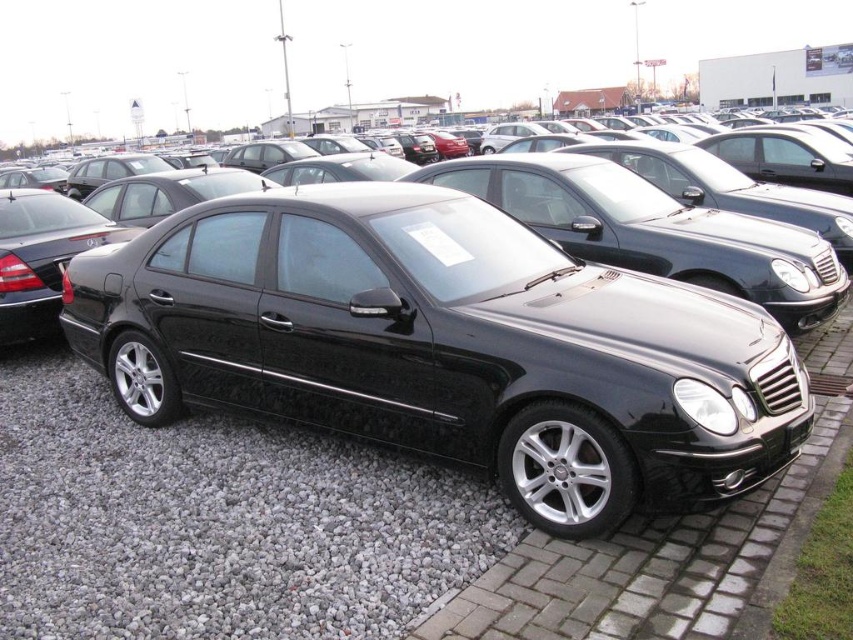
Question: Which point is closer to the camera?

Choices:
 (A) (331, 448)
 (B) (808, 394)

Answer: (B)

Question: Is glossy black car at center to the left of gray gravel at lower center from the viewer's perspective?

Choices:
 (A) no
 (B) yes

Answer: (A)

Question: Does glossy black car at center have a larger size compared to gray gravel at lower center?

Choices:
 (A) yes
 (B) no

Answer: (A)

Question: Considering the relative positions of glossy black car at center and gray gravel at lower center in the image provided, where is glossy black car at center located with respect to gray gravel at lower center?

Choices:
 (A) above
 (B) below

Answer: (A)

Question: Among these objects, which one is nearest to the camera?

Choices:
 (A) gray gravel at lower center
 (B) glossy black car at center

Answer: (A)

Question: Which point is closer to the camera taking this photo?

Choices:
 (A) (108, 570)
 (B) (610, 339)

Answer: (A)